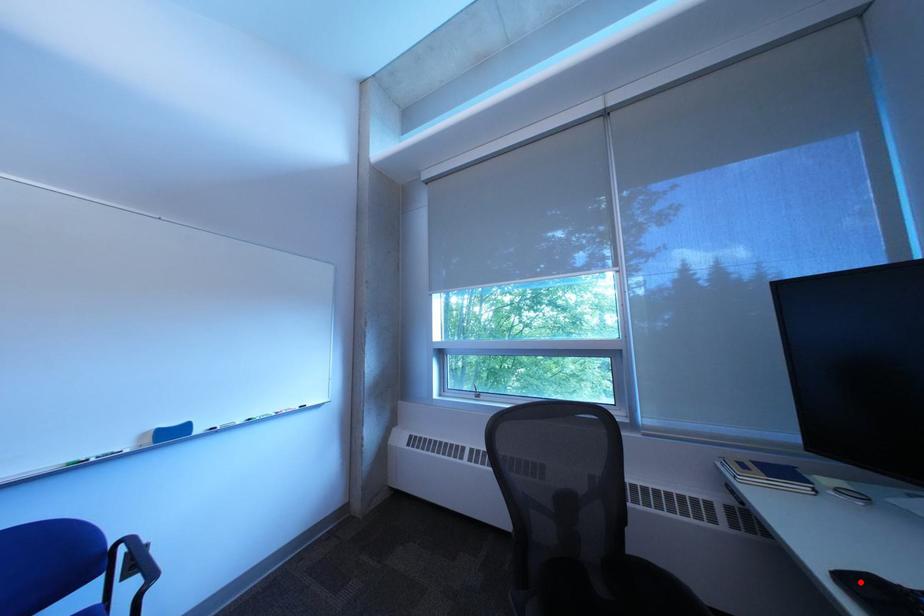
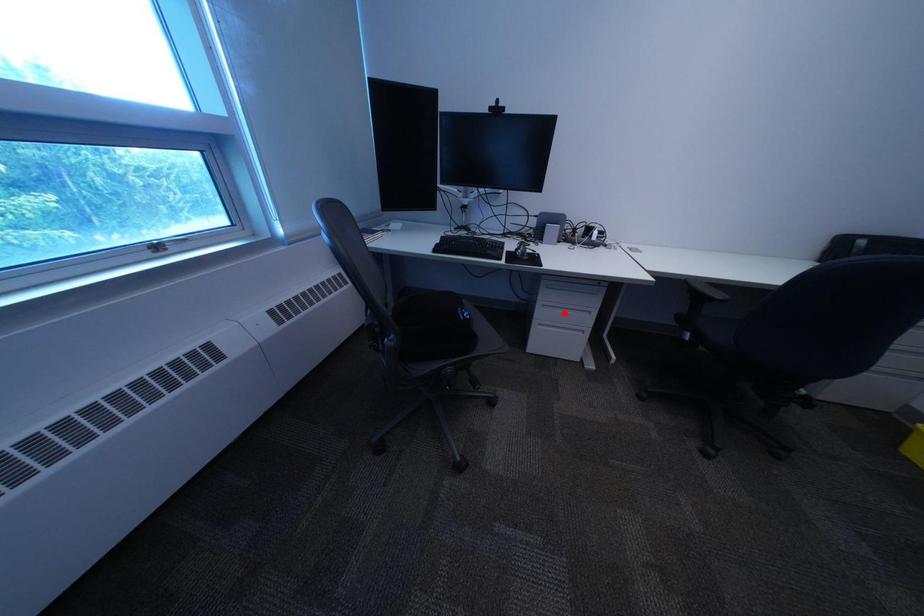
I am providing you with two images of the same scene from different viewpoints. A red point is marked on the first image and another point is marked on the second image. Do the highlighted points in image1 and image2 indicate the same real-world spot?

No